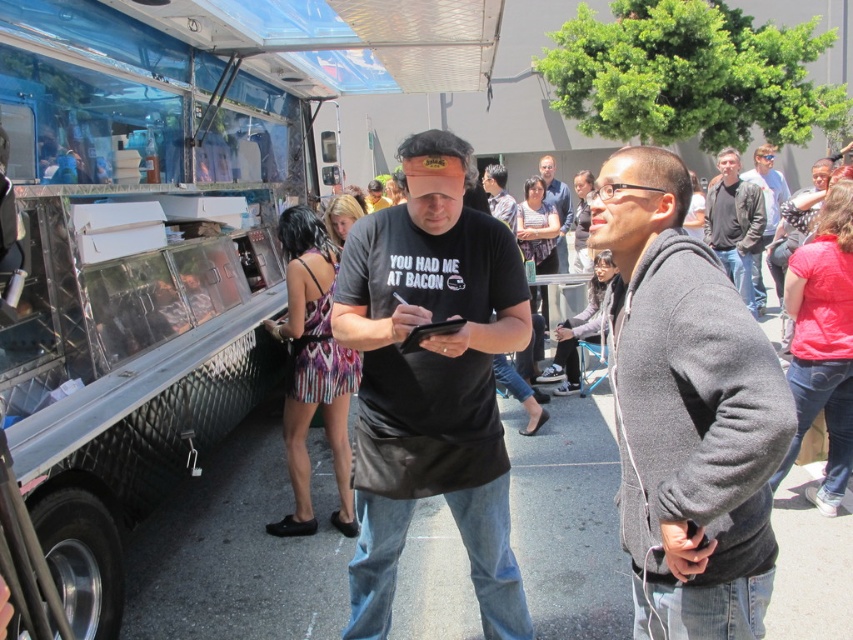
Which is more to the left, brushed metal food truck at left or gray fleece hoodie at right?

brushed metal food truck at left is more to the left.

Is brushed metal food truck at left smaller than gray fleece hoodie at right?

Actually, brushed metal food truck at left might be larger than gray fleece hoodie at right.

You are a GUI agent. You are given a task and a screenshot of the screen. Output one action in this format:
    pyautogui.click(x=<x>, y=<y>)
    Task: Click on the brushed metal food truck at left
    
    Given the screenshot: What is the action you would take?
    pyautogui.click(x=134, y=269)

The image size is (853, 640). In order to click on brushed metal food truck at left in this screenshot , I will do `click(134, 269)`.

Does gray fleece hoodie at right come in front of dark gray hoodie at center?

Yes, it is.

Does gray fleece hoodie at right have a smaller size compared to dark gray hoodie at center?

Yes.

The image size is (853, 640). Identify the location of gray fleece hoodie at right. (688, 412).

Who is positioned more to the left, gray fleece hoodie at right or matte black t-shirt at center?

gray fleece hoodie at right is more to the left.

Can you confirm if gray fleece hoodie at right is bigger than matte black t-shirt at center?

No.

Find the location of a particular element. gray fleece hoodie at right is located at coordinates (688, 412).